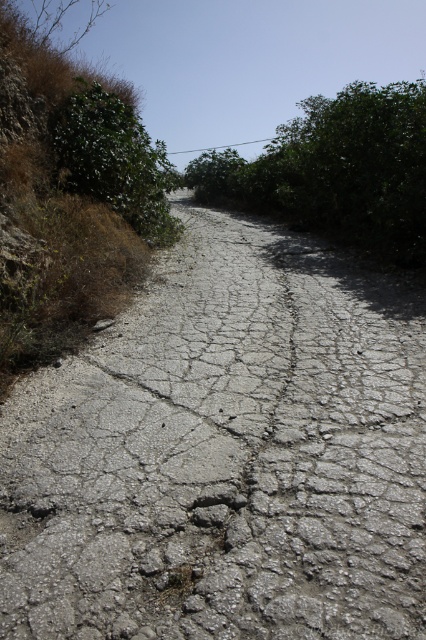
Question: Which object is positioned farthest from the cracked concrete road at center?

Choices:
 (A) green leafy bush at upper left
 (B) green leafy bush at center

Answer: (B)

Question: Which is farther from the green leafy bush at upper left?

Choices:
 (A) green leafy bush at center
 (B) cracked concrete road at center

Answer: (A)

Question: Which point is closer to the camera?

Choices:
 (A) cracked concrete road at center
 (B) green leafy bush at center
 (C) green leafy bush at upper left

Answer: (A)

Question: Where is cracked concrete road at center located in relation to green leafy bush at center in the image?

Choices:
 (A) right
 (B) left

Answer: (B)

Question: Can you confirm if green leafy bush at center is wider than green leafy bush at upper left?

Choices:
 (A) yes
 (B) no

Answer: (A)

Question: Is cracked concrete road at center below green leafy bush at upper left?

Choices:
 (A) no
 (B) yes

Answer: (B)